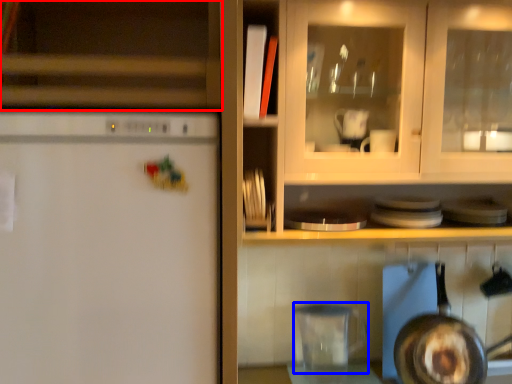
Question: Which object appears farthest to the camera in this image, cabinetry (highlighted by a red box) or appliance (highlighted by a blue box)?

Choices:
 (A) cabinetry
 (B) appliance

Answer: (B)